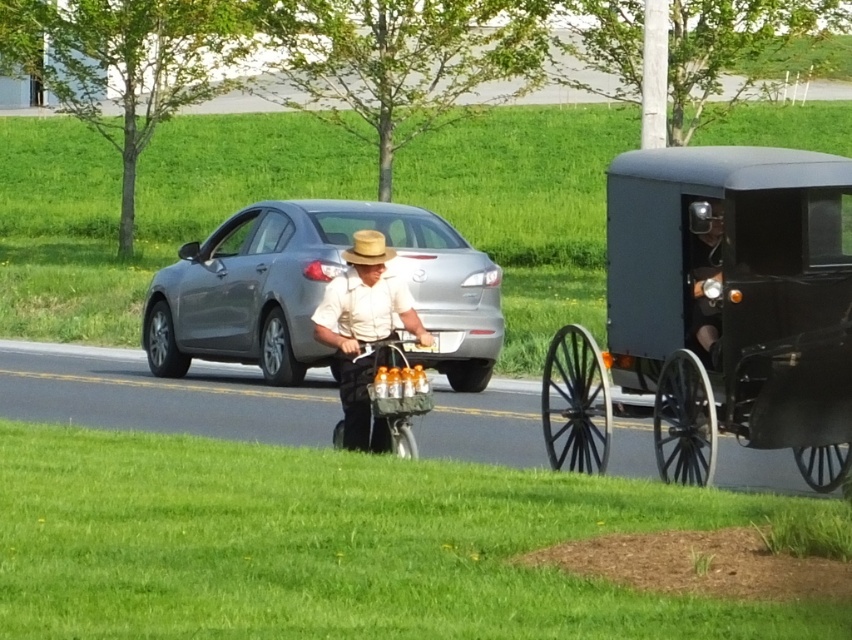
Describe the element at coordinates (394, 396) in the screenshot. I see `metallic silver bicycle at center` at that location.

Can you confirm if metallic silver bicycle at center is positioned to the right of light brown straw cowboy hat at center?

Incorrect, metallic silver bicycle at center is not on the right side of light brown straw cowboy hat at center.

Which is in front, point (390, 387) or point (372, 259)?

Positioned in front is point (390, 387).

At what (x,y) coordinates should I click in order to perform the action: click on metallic silver bicycle at center. Please return your answer as a coordinate pair (x, y). Looking at the image, I should click on (394, 396).

Does black wood wagon at right appear on the left side of metallic silver bicycle at center?

Incorrect, black wood wagon at right is not on the left side of metallic silver bicycle at center.

Image resolution: width=852 pixels, height=640 pixels. Identify the location of black wood wagon at right. (717, 314).

The width and height of the screenshot is (852, 640). Identify the location of black wood wagon at right. (717, 314).

Can you confirm if black wood wagon at right is bigger than light brown straw cowboy hat at center?

Correct, black wood wagon at right is larger in size than light brown straw cowboy hat at center.

Is black wood wagon at right thinner than light brown straw cowboy hat at center?

In fact, black wood wagon at right might be wider than light brown straw cowboy hat at center.

Is point (829, 477) farther from camera compared to point (360, 237)?

Yes, point (829, 477) is farther from viewer.

Identify the location of black wood wagon at right. This screenshot has width=852, height=640. (717, 314).